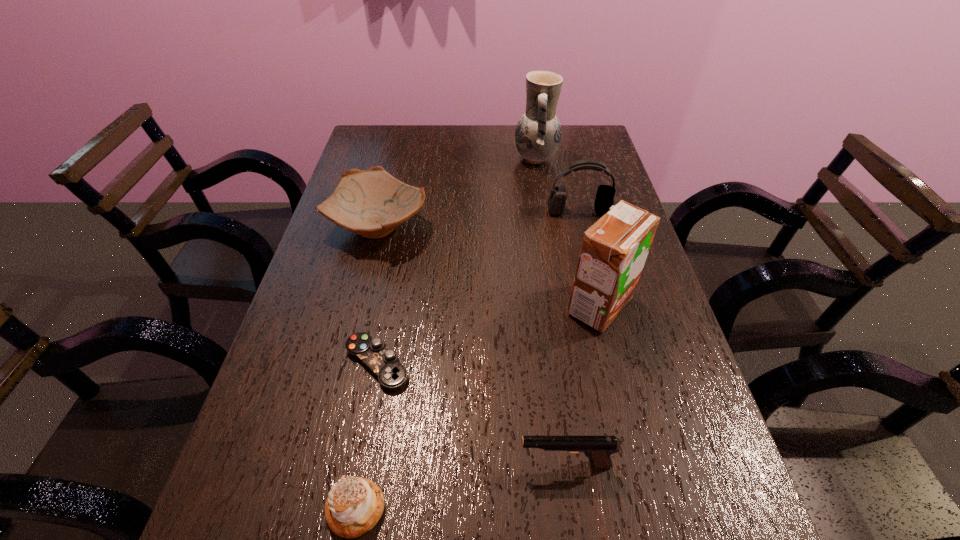
Where is `vacant space at the right edge`? Image resolution: width=960 pixels, height=540 pixels. vacant space at the right edge is located at coordinates (747, 538).

Locate an element on the screen. The image size is (960, 540). vacant area at the far left corner is located at coordinates (379, 143).

This screenshot has width=960, height=540. I want to click on vacant space at the far right corner, so click(x=594, y=145).

Identify the location of free point between the right pottery and the pistol. (550, 312).

Find the location of `free space that is in between the carton and the shorter pottery`. free space that is in between the carton and the shorter pottery is located at coordinates (489, 266).

The width and height of the screenshot is (960, 540). I want to click on vacant space in between the farther pottery and the second nearest object, so click(550, 312).

Locate an element on the screen. The height and width of the screenshot is (540, 960). vacant point located between the farthest object and the fourth farthest object is located at coordinates (567, 232).

Find the location of a particular element. This screenshot has width=960, height=540. free space between the headset and the second nearest object is located at coordinates (572, 338).

The height and width of the screenshot is (540, 960). Identify the location of free spot between the pistol and the nearer pottery. (472, 345).

Find the location of a particular element. vacant space that's between the taller pottery and the fourth nearest object is located at coordinates (567, 232).